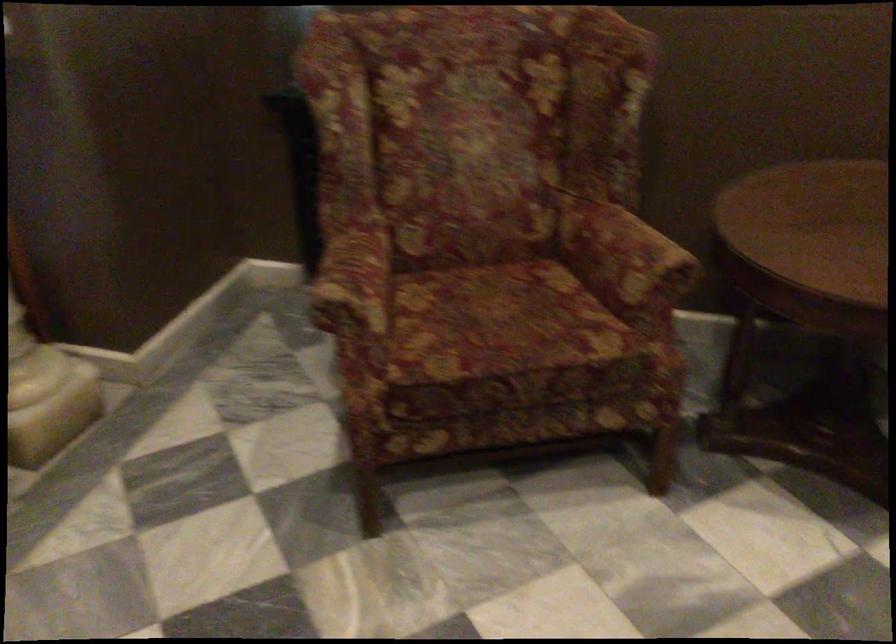
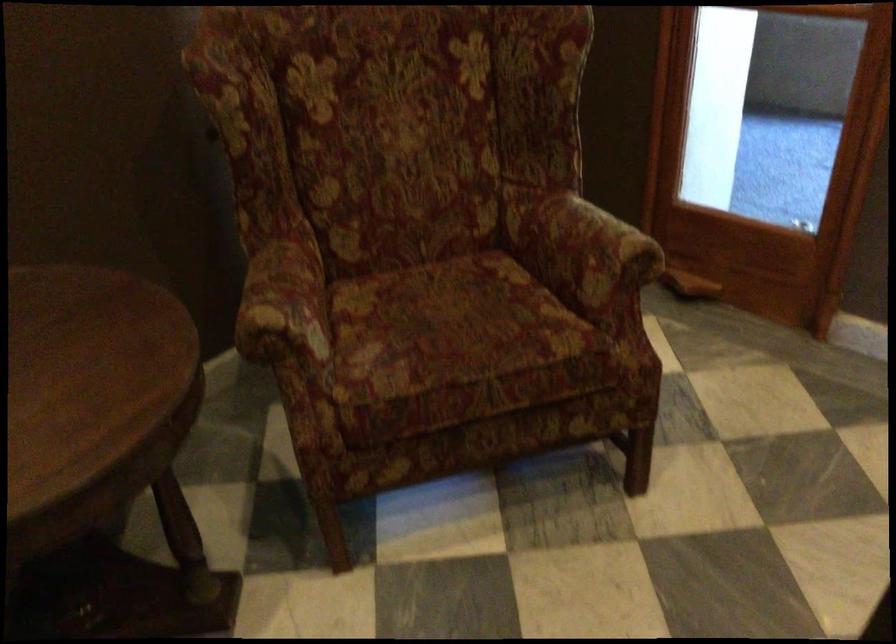
The first image is from the beginning of the video and the second image is from the end. How did the camera likely rotate when shooting the video?

The rotation direction of the camera is right-down.